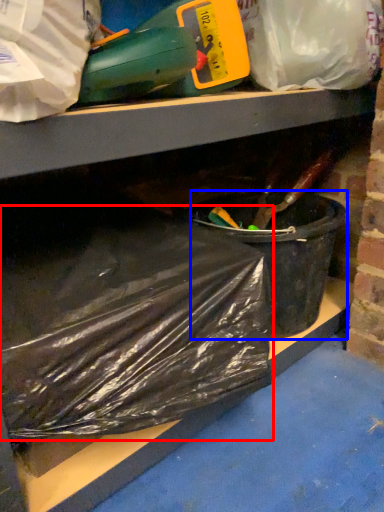
Question: Which object appears farthest to the camera in this image, plastic bag (highlighted by a red box) or recycling bin (highlighted by a blue box)?

Choices:
 (A) plastic bag
 (B) recycling bin

Answer: (B)